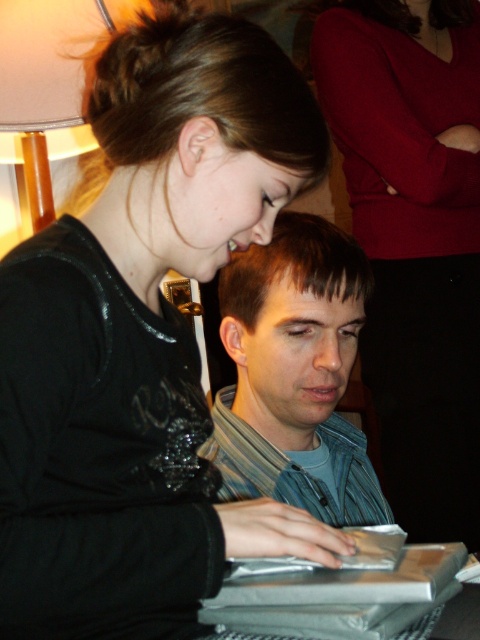
You are a tailor who needs to determine which item requires more fabric for a repair. Based on the scene, which item between the matte black sweater at upper left and the white fabric lampshade at upper left would need more fabric?

The matte black sweater at upper left requires more fabric for repair since it has a larger size compared to the white fabric lampshade at upper left.

You are a photographer trying to capture a detailed shot of both the black leather jacket at upper left and the denim jacket at center. Which jacket should you focus on first to ensure it appears sharp in the photo?

The black leather jacket at upper left is closer to the viewer than the denim jacket at center, so you should focus on the black leather jacket at upper left first to ensure it appears sharp in the photo.

You are a photographer setting up a photo shoot in this scene. You need to place a spotlight so that it illuminates both the black leather jacket at upper left and the denim jacket at center without casting shadows over other parts of the scene. Based on their positions, which jacket should you position the spotlight closer to?

The black leather jacket at upper left is taller than the denim jacket at center, so you should position the spotlight closer to the black leather jacket at upper left to ensure both are illuminated properly without casting shadows over other areas.